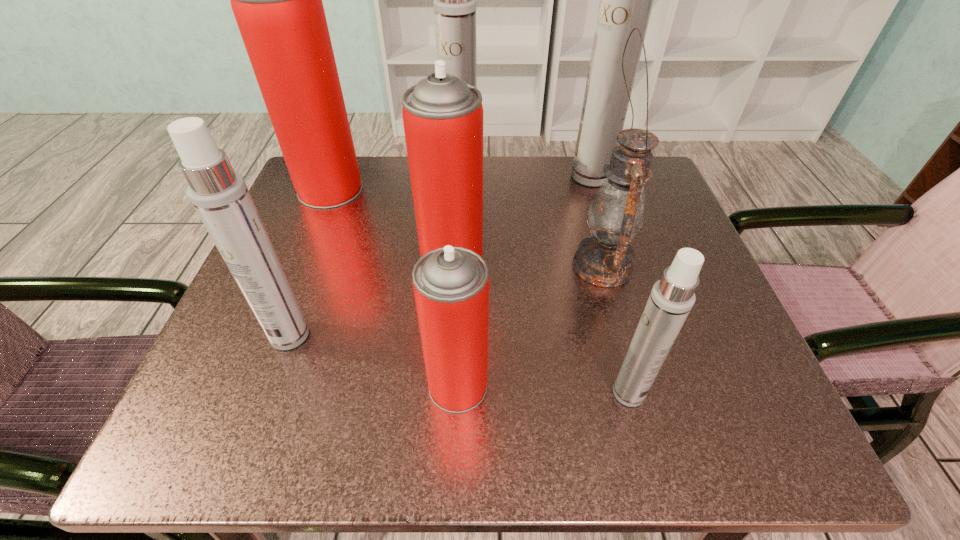
Where is `free spot between the fourth farthest aerosol can and the third farthest white aerosol can`? The height and width of the screenshot is (540, 960). free spot between the fourth farthest aerosol can and the third farthest white aerosol can is located at coordinates (371, 299).

This screenshot has height=540, width=960. In order to click on free point between the nearest white aerosol can and the nearest red aerosol can in this screenshot , I will do `click(543, 389)`.

I want to click on vacant space in between the smallest white aerosol can and the oil lamp, so click(615, 329).

Where is `unoccupied area between the third smallest white aerosol can and the leftmost red aerosol can`? This screenshot has height=540, width=960. unoccupied area between the third smallest white aerosol can and the leftmost red aerosol can is located at coordinates (396, 182).

This screenshot has width=960, height=540. I want to click on free space between the fourth nearest aerosol can and the nearest white aerosol can, so click(x=540, y=328).

Locate an element on the screen. the seventh closest object to the smallest white aerosol can is located at coordinates (277, 2).

Find the location of a particular element. The height and width of the screenshot is (540, 960). object that is the third closest to the oil lamp is located at coordinates 626,0.

Find the location of a particular element. The image size is (960, 540). aerosol can object that ranks as the fifth closest to the oil lamp is located at coordinates (454, 1).

Point out which aerosol can is positioned as the sixth nearest to the nearest red aerosol can. Please provide its 2D coordinates. Your answer should be formatted as a tuple, i.e. [(x, y)], where the tuple contains the x and y coordinates of a point satisfying the conditions above.

[(626, 0)]

Point out which white aerosol can is positioned as the second nearest to the biggest white aerosol can. Please provide its 2D coordinates. Your answer should be formatted as a tuple, i.e. [(x, y)], where the tuple contains the x and y coordinates of a point satisfying the conditions above.

[(672, 298)]